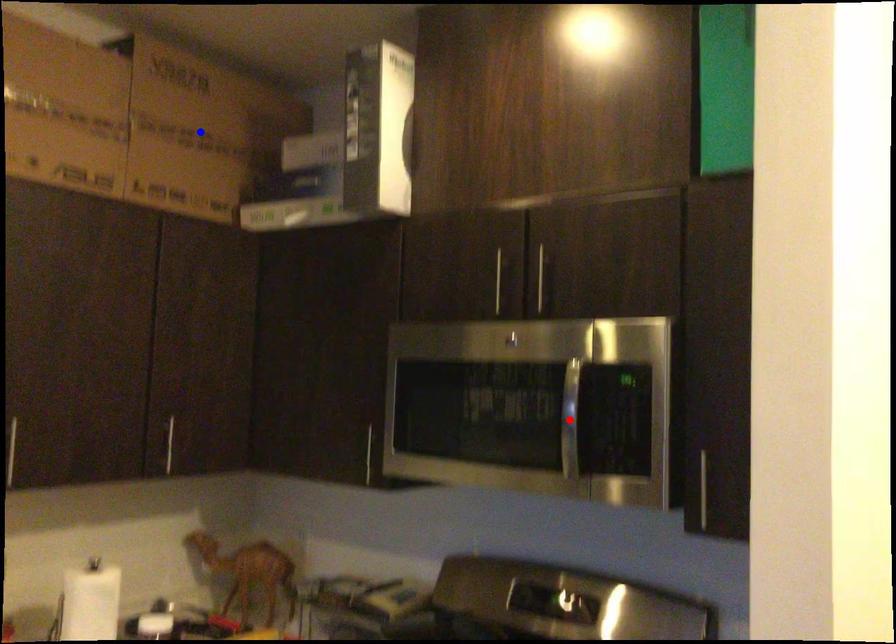
Question: Two points are marked on the image. Which point is closer to the camera?

Choices:
 (A) Blue point is closer.
 (B) Red point is closer.

Answer: (B)